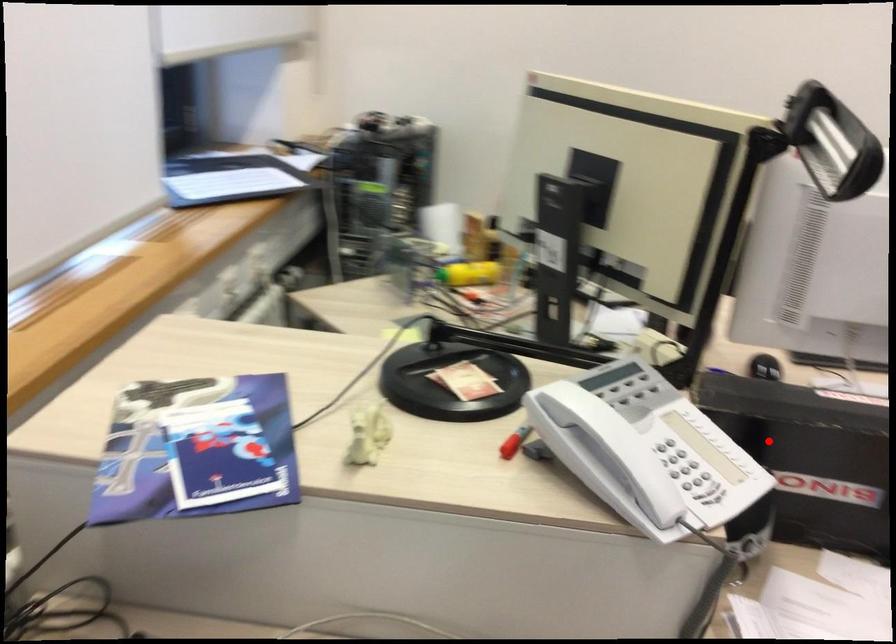
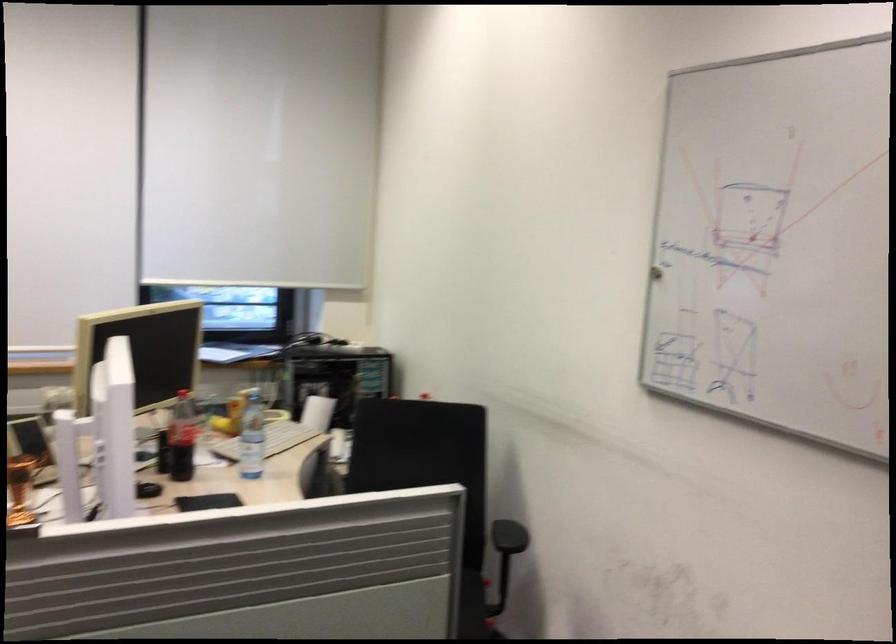
Question: I am providing you with two images of the same scene from different viewpoints. In image1, a red point is highlighted. Considering the same 3D point in image2, which of the following is correct?

Choices:
 (A) It is closer
 (B) It is farther

Answer: (B)